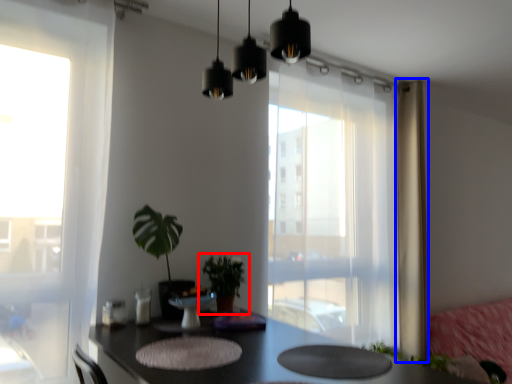
Question: Which object appears closest to the camera in this image, houseplant (highlighted by a red box) or curtain (highlighted by a blue box)?

Choices:
 (A) houseplant
 (B) curtain

Answer: (A)